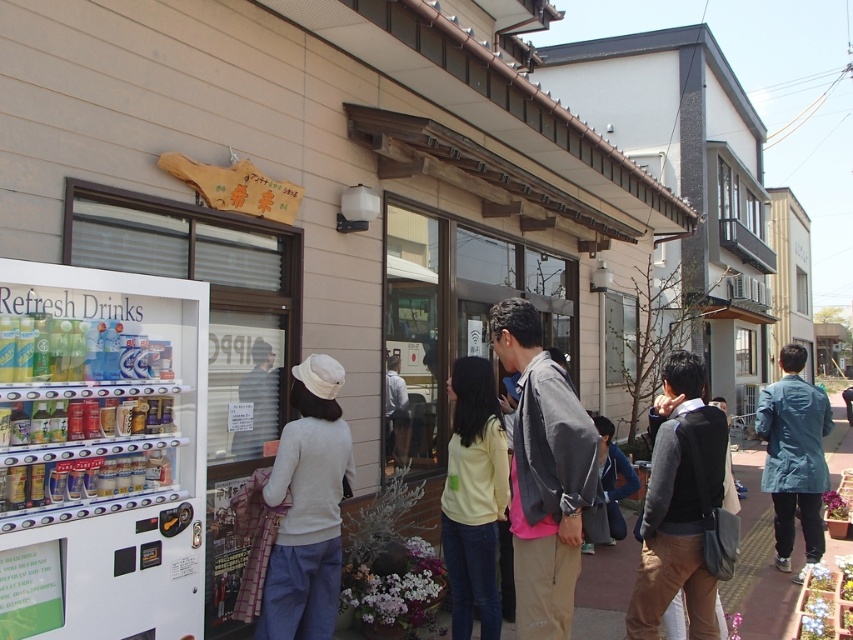
Who is lower down, teal fabric jacket at right or denim jacket at lower right?

Positioned lower is denim jacket at lower right.

Is teal fabric jacket at right taller than denim jacket at lower right?

No, teal fabric jacket at right is not taller than denim jacket at lower right.

Between point (809, 404) and point (631, 484), which one is positioned in front?

Point (809, 404) is more forward.

In order to click on teal fabric jacket at right in this screenshot , I will do `click(793, 456)`.

Can you confirm if white plastic vending machine at lower left is positioned below gray fabric jacket at center?

Incorrect, white plastic vending machine at lower left is not positioned below gray fabric jacket at center.

Describe the element at coordinates (100, 452) in the screenshot. I see `white plastic vending machine at lower left` at that location.

The height and width of the screenshot is (640, 853). In order to click on white plastic vending machine at lower left in this screenshot , I will do `click(100, 452)`.

Which is above, white plastic vending machine at lower left or yellow matte shirt at center?

white plastic vending machine at lower left

The height and width of the screenshot is (640, 853). Describe the element at coordinates (100, 452) in the screenshot. I see `white plastic vending machine at lower left` at that location.

Locate an element on the screen. The height and width of the screenshot is (640, 853). white plastic vending machine at lower left is located at coordinates (100, 452).